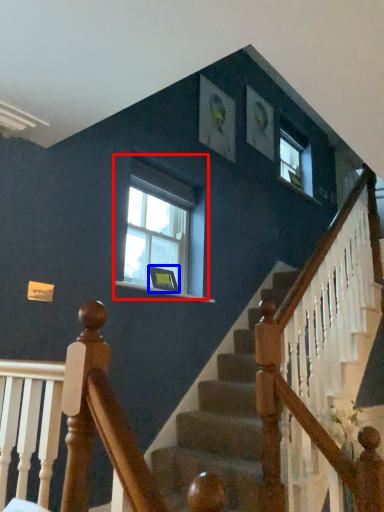
Question: Which of the following is the closest to the observer, window (highlighted by a red box) or picture frame (highlighted by a blue box)?

Choices:
 (A) window
 (B) picture frame

Answer: (A)